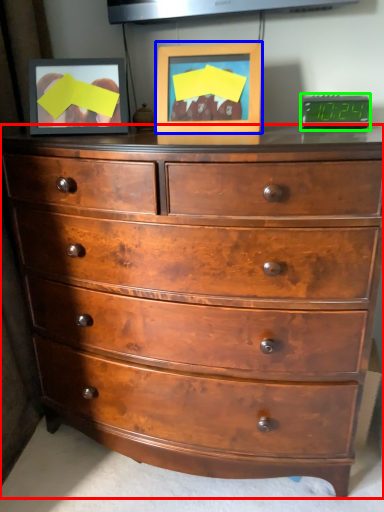
Question: Based on their relative distances, which object is farther from chest of drawers (highlighted by a red box)? Choose from picture frame (highlighted by a blue box) and alarm clock (highlighted by a green box).

Choices:
 (A) picture frame
 (B) alarm clock

Answer: (B)